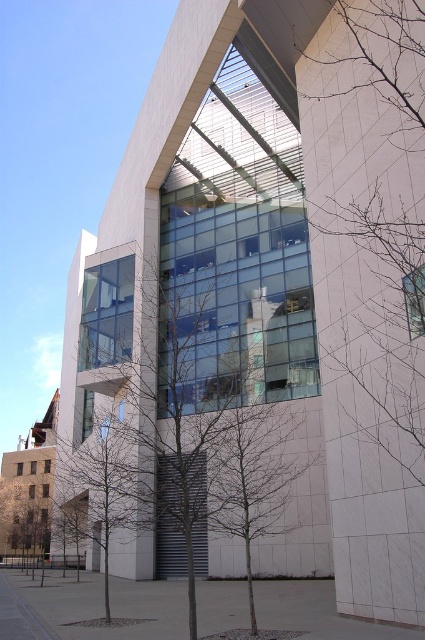
Question: Is bare branches at right below bare branches at center?

Choices:
 (A) no
 (B) yes

Answer: (A)

Question: Which object appears farthest from the camera in this image?

Choices:
 (A) bare branches at center
 (B) bare branches at right

Answer: (A)

Question: Which point is closer to the camera?

Choices:
 (A) green leafless tree at center
 (B) bare branches at center
 (C) bare branches at right

Answer: (C)

Question: Which point is closer to the camera?

Choices:
 (A) green leafless tree at center
 (B) bare branches at center
 (C) bare branches at right

Answer: (C)

Question: Does green leafless tree at center have a lesser width compared to bare branches at right?

Choices:
 (A) no
 (B) yes

Answer: (A)

Question: Can you confirm if bare branches at right is bigger than bare branches at center?

Choices:
 (A) no
 (B) yes

Answer: (A)